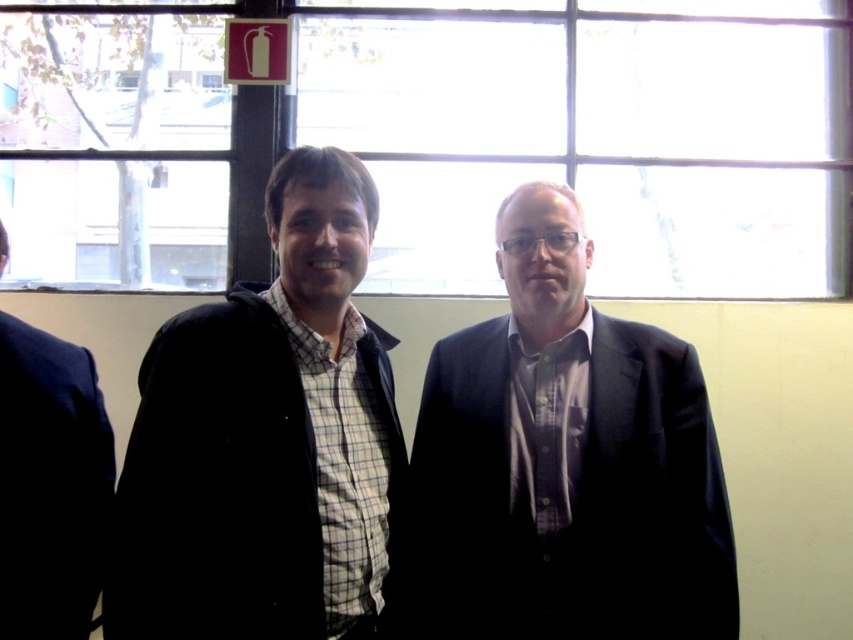
You are an architect designing a virtual reality space and need to place a virtual object exactly where the dark gray suit at center is located. What are the coordinates you should use?

The coordinates for the dark gray suit at center are at point (566, 461).

You are a photographer trying to capture both the dark gray suit at center and the matte black jacket at center in a single frame. Which person should you focus on first if you want to start from the left side of the scene?

You should focus on the matte black jacket at center first since it is positioned on the left side of the dark gray suit at center, so starting from the left would mean addressing the matte black jacket at center before the dark gray suit at center.

You are an interior designer assessing the placement of furniture in a room. You notice a dark gray suit at center located at point (566, 461). Is there enough space between the two people in the image to place a small side table? Please consider their positions and the available area.

The dark gray suit at center is located at point (566, 461), but the description does not provide information about the distance between the two people. Therefore, it is impossible to determine if there is enough space for a small side table between them.